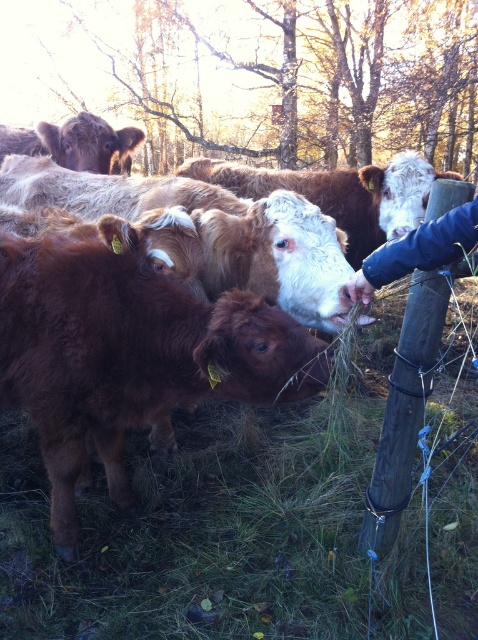
Question: Which point is closer to the camera?

Choices:
 (A) (292, 180)
 (B) (369, 269)
 (C) (240, 307)

Answer: (B)

Question: Is the position of brown fuzzy cow at center more distant than that of brown woolen cow at upper left?

Choices:
 (A) yes
 (B) no

Answer: (B)

Question: Can you confirm if brown wooden post at right is positioned to the left of brown woolen cow at upper left?

Choices:
 (A) yes
 (B) no

Answer: (B)

Question: Among these points, which one is farthest from the camera?

Choices:
 (A) (127, 264)
 (B) (425, 253)

Answer: (A)

Question: Which is farther from the brown woolen cow at center?

Choices:
 (A) brown wooden post at right
 (B) brown woolen cow at upper left
 (C) brown furry calf at center

Answer: (C)

Question: Is brown furry calf at center to the left of blue fabric sleeve at upper right from the viewer's perspective?

Choices:
 (A) yes
 (B) no

Answer: (A)